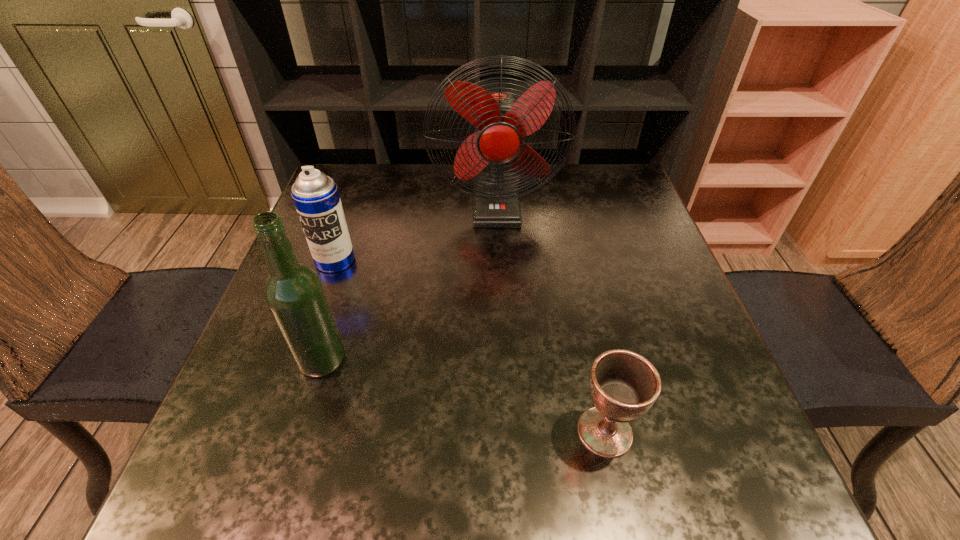
Identify which object is the closest to the liquor. Please provide its 2D coordinates. Your answer should be formatted as a tuple, i.e. [(x, y)], where the tuple contains the x and y coordinates of a point satisfying the conditions above.

[(315, 195)]

Where is `object that is the closest to the second farthest object`? object that is the closest to the second farthest object is located at coordinates (502, 120).

Find the location of a particular element. The height and width of the screenshot is (540, 960). free point that satisfies the following two spatial constraints: 1. on the label side of the third tallest object; 2. on the left side of the third farthest object is located at coordinates (300, 360).

Locate an element on the screen. The image size is (960, 540). vacant space that satisfies the following two spatial constraints: 1. on the label side of the third nearest object; 2. on the left side of the liquor is located at coordinates (300, 360).

This screenshot has width=960, height=540. What are the coordinates of `free space that satisfies the following two spatial constraints: 1. on the label side of the third nearest object; 2. on the left side of the third shortest object` in the screenshot? It's located at (300, 360).

Where is `free space in the image that satisfies the following two spatial constraints: 1. on the front-facing side of the nearest object; 2. on the right side of the fan`? The height and width of the screenshot is (540, 960). free space in the image that satisfies the following two spatial constraints: 1. on the front-facing side of the nearest object; 2. on the right side of the fan is located at coordinates (507, 431).

At what (x,y) coordinates should I click in order to perform the action: click on free space that satisfies the following two spatial constraints: 1. on the front side of the third farthest object; 2. on the left side of the chalice. Please return your answer as a coordinate pair (x, y). This screenshot has height=540, width=960. Looking at the image, I should click on (300, 431).